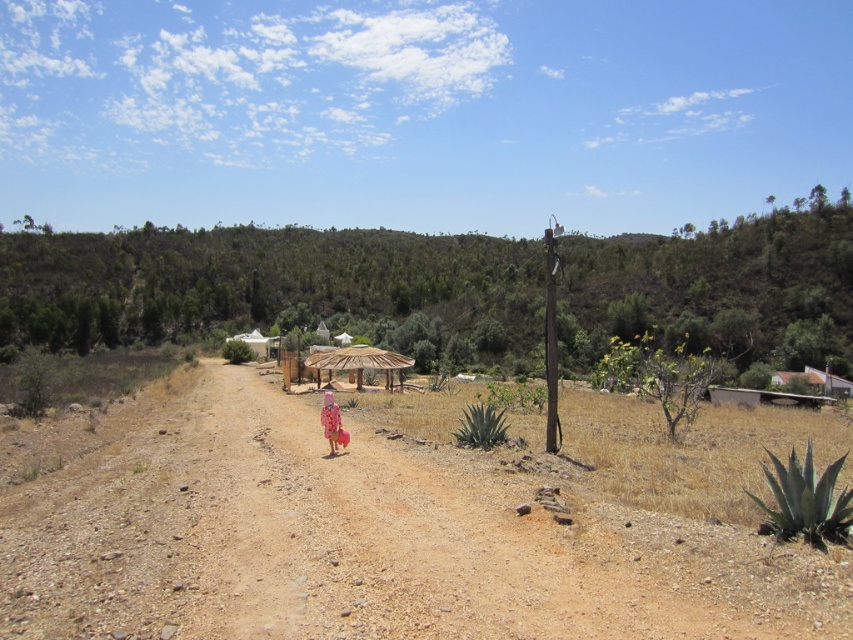
Question: Does brown gravelly dirt field at center have a greater width compared to natural straw umbrella at center?

Choices:
 (A) yes
 (B) no

Answer: (A)

Question: Among these points, which one is farthest from the camera?

Choices:
 (A) (378, 358)
 (B) (213, 442)
 (C) (328, 413)

Answer: (A)

Question: Observing the image, what is the correct spatial positioning of natural straw umbrella at center in reference to pink fabric dress at center?

Choices:
 (A) below
 (B) above

Answer: (B)

Question: Does brown gravelly dirt field at center have a larger size compared to pink fabric dress at center?

Choices:
 (A) no
 (B) yes

Answer: (B)

Question: Estimate the real-world distances between objects in this image. Which object is farther from the pink fabric dress at center?

Choices:
 (A) brown gravelly dirt field at center
 (B) natural straw umbrella at center

Answer: (B)

Question: Which point is farther from the camera taking this photo?

Choices:
 (A) (347, 356)
 (B) (323, 420)
 (C) (250, 476)

Answer: (A)